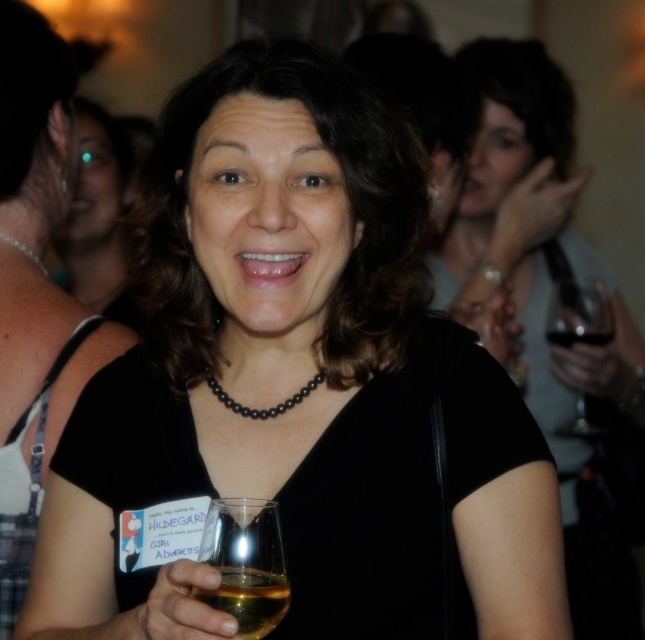
Is point (52, 186) positioned behind point (608, 340)?

No, it is not.

Who is more distant from viewer, (5, 464) or (584, 333)?

Point (584, 333)

Locate an element on the screen. black matte necklace at upper center is located at coordinates [x=35, y=401].

Does matte black dress at center have a smaller size compared to black beaded necklace at center?

No.

This screenshot has height=640, width=645. In order to click on matte black dress at center in this screenshot , I will do `click(541, 300)`.

Is point (531, 394) less distant than point (226, 397)?

That is False.

Where is `matte black dress at center`? This screenshot has height=640, width=645. matte black dress at center is located at coordinates (541, 300).

Measure the distance between clear glass wine glass at lower center and clear glass wine at center.

A distance of 4.09 feet exists between clear glass wine glass at lower center and clear glass wine at center.

From the picture: Who is taller, clear glass wine glass at lower center or clear glass wine at center?

clear glass wine glass at lower center is taller.

Is point (201, 550) farther from viewer compared to point (553, 336)?

No, it is not.

I want to click on clear glass wine glass at lower center, so tap(244, 563).